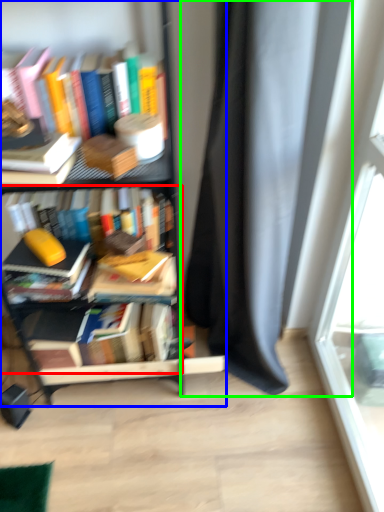
Question: Which object is the closest to the book (highlighted by a red box)? Choose among these: bookcase (highlighted by a blue box) or curtain (highlighted by a green box).

Choices:
 (A) bookcase
 (B) curtain

Answer: (A)